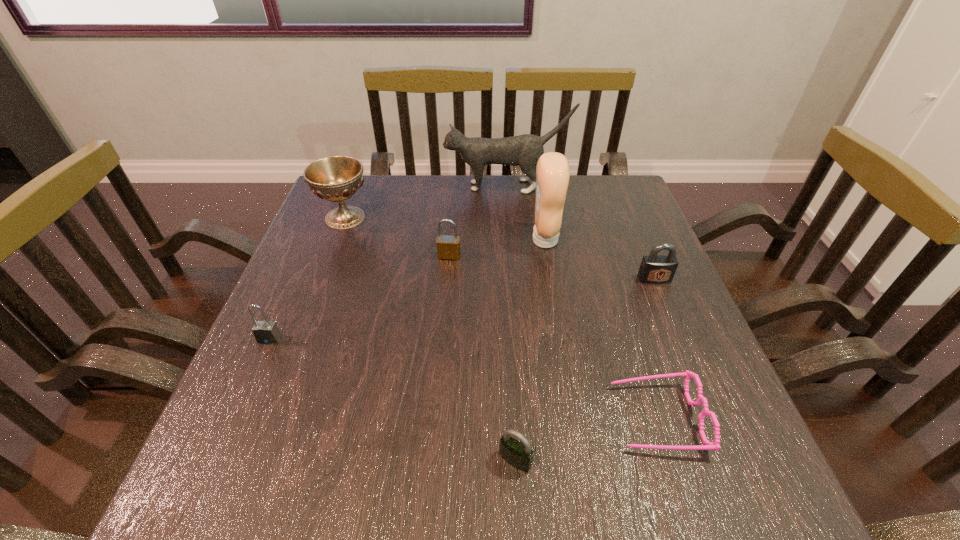
Locate an element on the screen. The width and height of the screenshot is (960, 540). cat is located at coordinates (524, 150).

Locate an element on the screen. condiment is located at coordinates [x=552, y=171].

Find the location of a particular element. chalice is located at coordinates (336, 178).

Where is `the second padlock from left to right`? the second padlock from left to right is located at coordinates (448, 247).

You are a GUI agent. You are given a task and a screenshot of the screen. Output one action in this format:
    pyautogui.click(x=<x>, y=<y>)
    Task: Click on the fourth nearest object
    
    Given the screenshot: What is the action you would take?
    pyautogui.click(x=656, y=269)

Locate an element on the screen. The width and height of the screenshot is (960, 540). the second farthest padlock is located at coordinates (656, 269).

Find the location of a particular element. Image resolution: width=960 pixels, height=540 pixels. the leftmost padlock is located at coordinates (x=266, y=332).

Find the location of a particular element. This screenshot has height=540, width=960. the sixth farthest object is located at coordinates (266, 332).

Where is `the third padlock from left to right`? the third padlock from left to right is located at coordinates (519, 455).

Find the location of a particular element. This screenshot has width=960, height=540. the second shortest object is located at coordinates (519, 455).